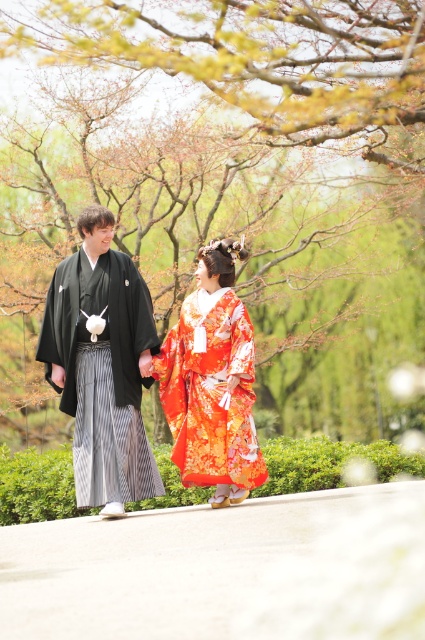
Which is behind, point (299, 540) or point (153, 372)?

The point (153, 372) is behind.

Does smooth concrete path at center have a greater height compared to floral silk kimono at center?

No, smooth concrete path at center is not taller than floral silk kimono at center.

Where is `smooth concrete path at center`? This screenshot has height=640, width=425. smooth concrete path at center is located at coordinates (221, 570).

Describe the element at coordinates (221, 570) in the screenshot. I see `smooth concrete path at center` at that location.

Is smooth concrete path at center thinner than orange floral kimono at center?

No, smooth concrete path at center is not thinner than orange floral kimono at center.

Does point (289, 522) come farther from viewer compared to point (50, 371)?

No, (289, 522) is closer to viewer.

Where is `smooth concrete path at center`? The height and width of the screenshot is (640, 425). smooth concrete path at center is located at coordinates (221, 570).

Does orange floral kimono at center appear on the left side of black silk kimono at left?

Indeed, orange floral kimono at center is positioned on the left side of black silk kimono at left.

Is point (141, 321) in front of point (73, 289)?

Yes, it is in front of point (73, 289).

Does point (96, 234) come in front of point (130, 488)?

No, it is behind (130, 488).

The width and height of the screenshot is (425, 640). Find the location of `orange floral kimono at center`. orange floral kimono at center is located at coordinates (102, 365).